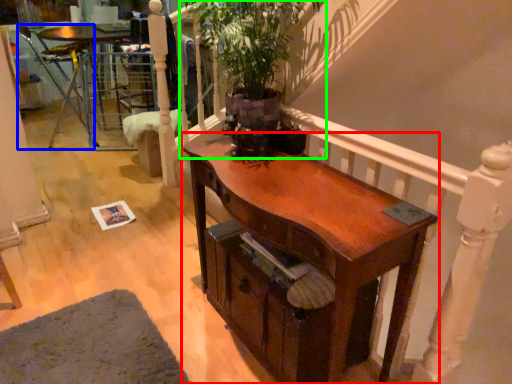
Question: Considering the real-world distances, which object is farthest from desk (highlighted by a red box)? armchair (highlighted by a blue box) or houseplant (highlighted by a green box)?

Choices:
 (A) armchair
 (B) houseplant

Answer: (A)